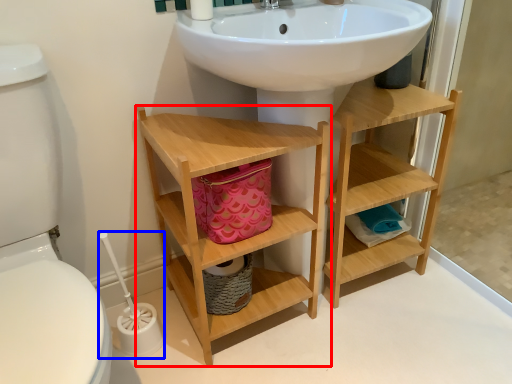
Question: Which of the following is the closest to the observer, bathroom cabinet (highlighted by a red box) or brush (highlighted by a blue box)?

Choices:
 (A) bathroom cabinet
 (B) brush

Answer: (A)